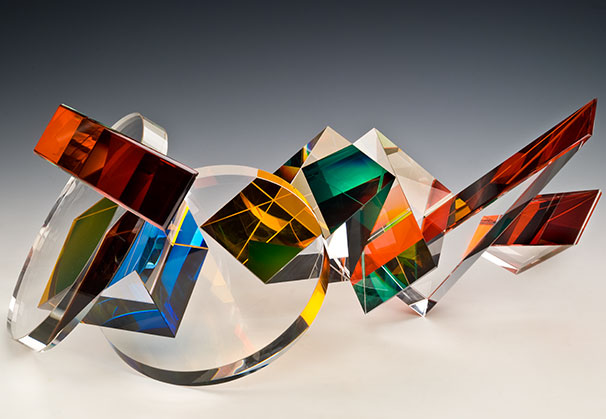
Image resolution: width=606 pixels, height=419 pixels. In order to click on table in this screenshot , I will do `click(438, 359)`.